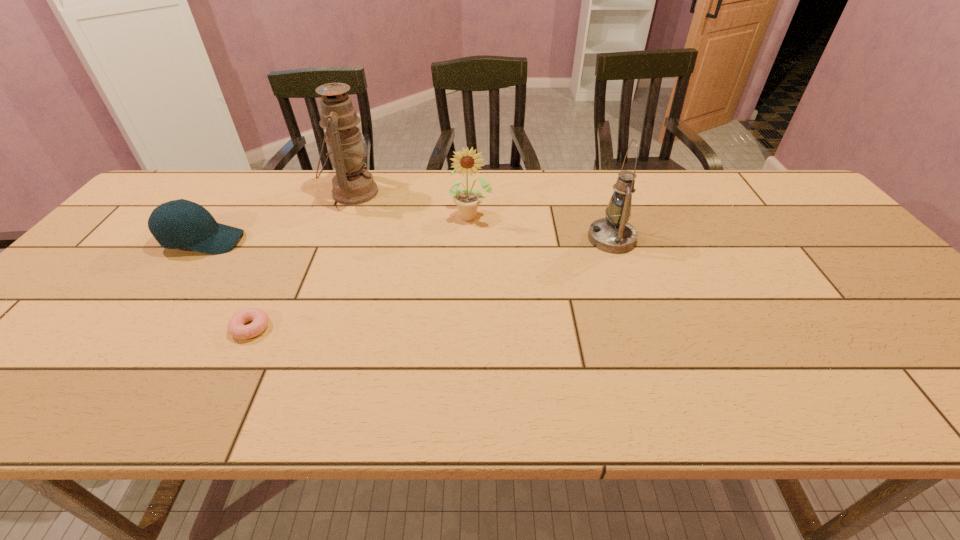
Locate an element on the screen. the left oil lamp is located at coordinates (352, 185).

I want to click on the nearer oil lamp, so click(x=613, y=234).

This screenshot has height=540, width=960. I want to click on the right oil lamp, so click(613, 234).

Locate an element on the screen. sunflower is located at coordinates (467, 201).

The width and height of the screenshot is (960, 540). I want to click on the third tallest object, so click(467, 201).

The image size is (960, 540). Find the location of `the leftmost object`. the leftmost object is located at coordinates (178, 224).

Identify the location of the second shortest object. This screenshot has width=960, height=540. (178, 224).

The width and height of the screenshot is (960, 540). What are the coordinates of `doughnut` in the screenshot? It's located at (x=236, y=328).

The height and width of the screenshot is (540, 960). Identify the location of the nearest object. (236, 328).

Find the location of a particular element. This screenshot has height=540, width=960. vacant space located 0.360m on the right of the farther oil lamp is located at coordinates [x=492, y=192].